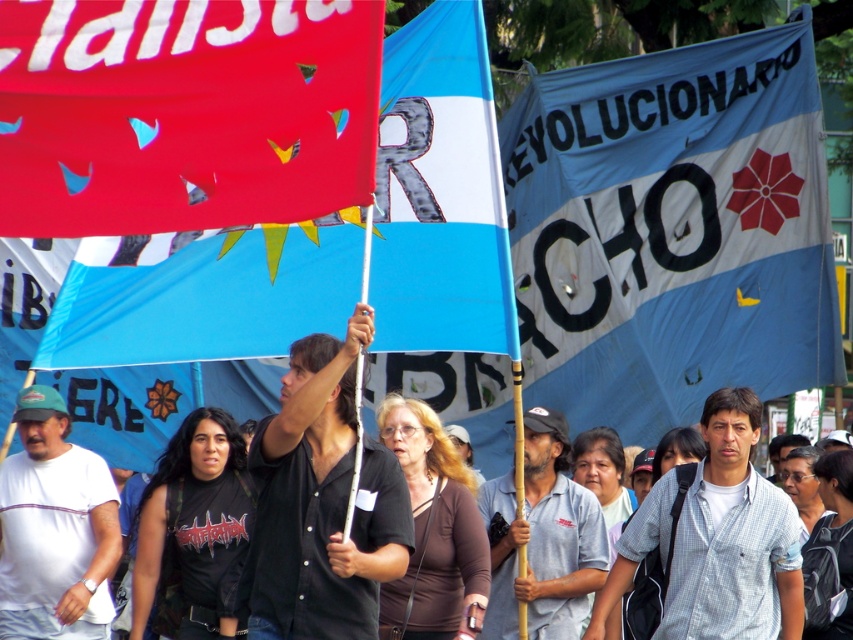
Question: Is blue fabric banner at center further to the viewer compared to white matte t-shirt at left?

Choices:
 (A) yes
 (B) no

Answer: (A)

Question: Is white matte t-shirt at left bigger than black fabric crowd at center?

Choices:
 (A) yes
 (B) no

Answer: (B)

Question: Estimate the real-world distances between objects in this image. Which object is farther from the black fabric crowd at center?

Choices:
 (A) matte plastic flag at upper center
 (B) blue fabric banner at center
 (C) white matte t-shirt at left

Answer: (B)

Question: Is matte red flag at upper left above gray checkered shirt at center?

Choices:
 (A) no
 (B) yes

Answer: (B)

Question: Among these objects, which one is farthest from the camera?

Choices:
 (A) black matte shirt at center
 (B) matte red flag at upper left
 (C) matte plastic flag at upper center

Answer: (A)

Question: Which of the following is the closest to the observer?

Choices:
 (A) (715, 564)
 (B) (352, 394)
 (C) (288, 120)

Answer: (C)